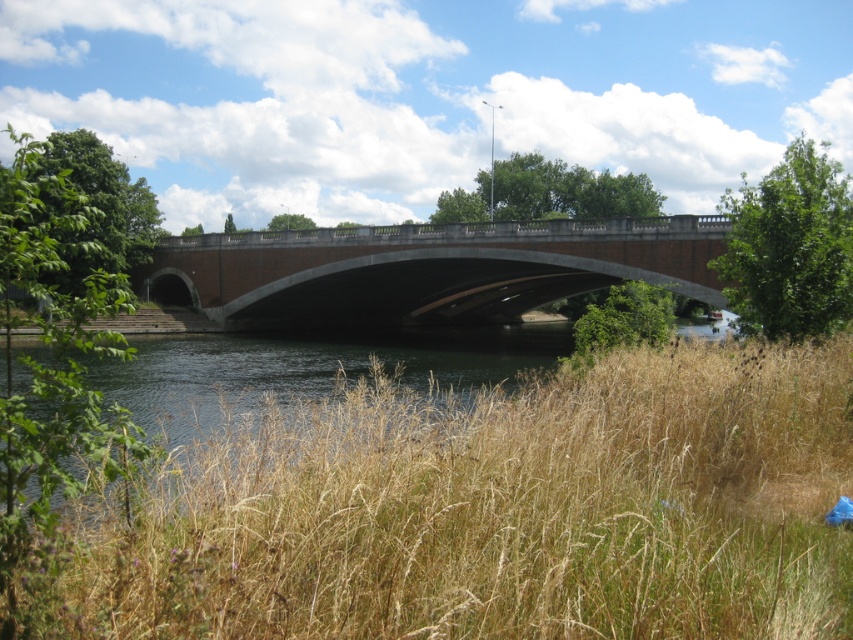
Can you confirm if dry grass at lower center is positioned to the right of brick stone bridge at center?

No, dry grass at lower center is not to the right of brick stone bridge at center.

Is dry grass at lower center thinner than brick stone bridge at center?

Indeed, dry grass at lower center has a lesser width compared to brick stone bridge at center.

Describe the element at coordinates (492, 512) in the screenshot. Image resolution: width=853 pixels, height=640 pixels. I see `dry grass at lower center` at that location.

Where is `dry grass at lower center`? Image resolution: width=853 pixels, height=640 pixels. dry grass at lower center is located at coordinates (492, 512).